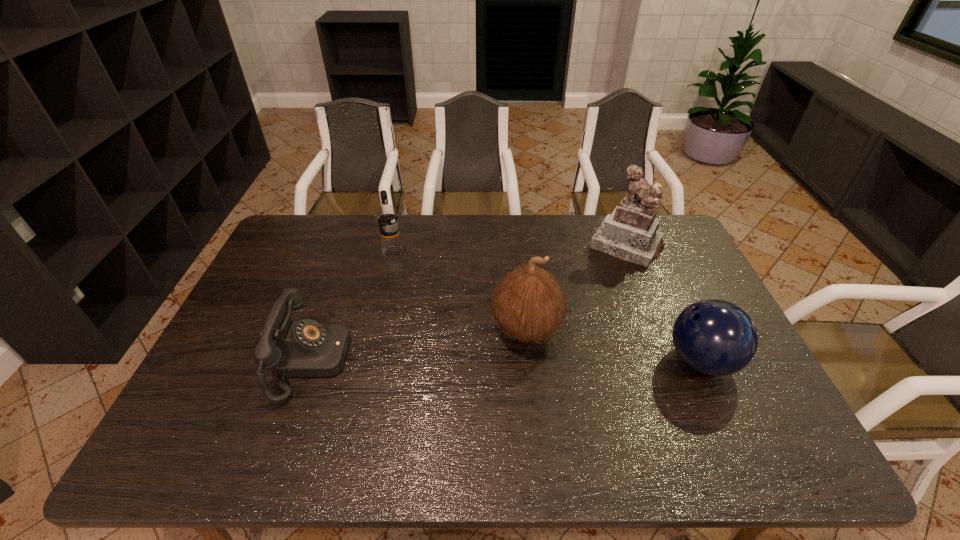
Identify the location of free region at the right edge of the desktop. (683, 266).

Identify the location of vacant space at the far left corner of the desktop. The image size is (960, 540). (290, 243).

Where is `free space between the second object from left to right and the figurine`? free space between the second object from left to right and the figurine is located at coordinates (510, 249).

Locate an element on the screen. This screenshot has height=540, width=960. free space between the bowling ball and the shortest object is located at coordinates (506, 361).

Where is `unoccupied area between the vodka and the figurine`? unoccupied area between the vodka and the figurine is located at coordinates (510, 249).

In order to click on unoccupied position between the leftmost object and the third object from right to left in this screenshot , I will do `click(419, 345)`.

I want to click on unoccupied area between the fourth object from right to left and the third object from left to right, so click(x=460, y=291).

Locate an element on the screen. The width and height of the screenshot is (960, 540). unoccupied position between the bowling ball and the figurine is located at coordinates coord(664,303).

Find the location of a particular element. This screenshot has width=960, height=540. empty location between the second object from left to right and the figurine is located at coordinates (510, 249).

Where is `free space that is in between the shortest object and the coconut`? This screenshot has height=540, width=960. free space that is in between the shortest object and the coconut is located at coordinates (419, 345).